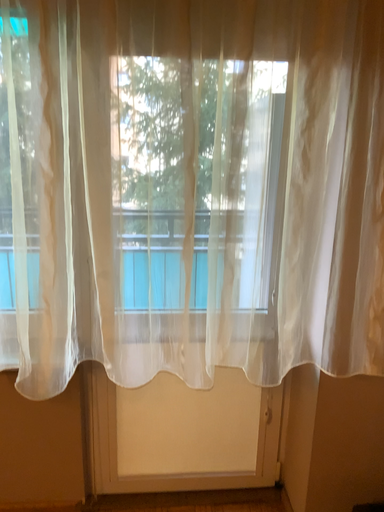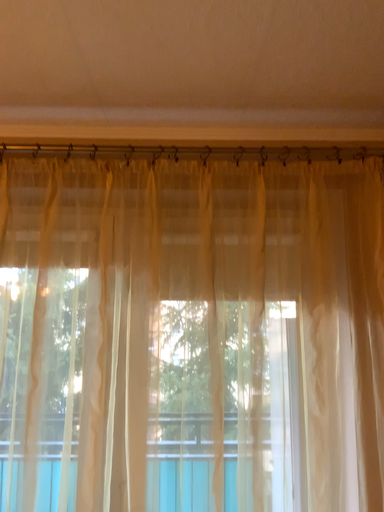
Question: Which way did the camera rotate in the video?

Choices:
 (A) rotated downward
 (B) rotated upward

Answer: (B)